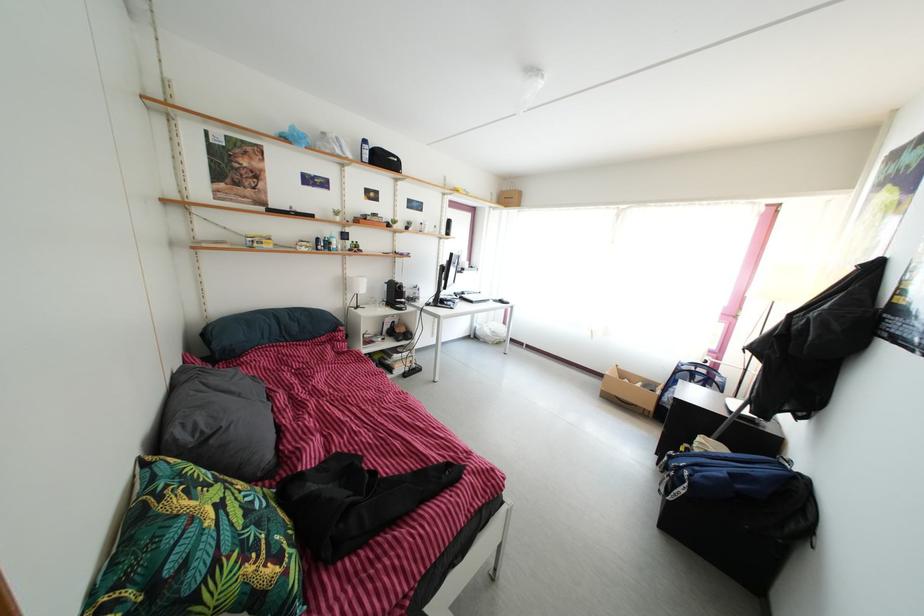
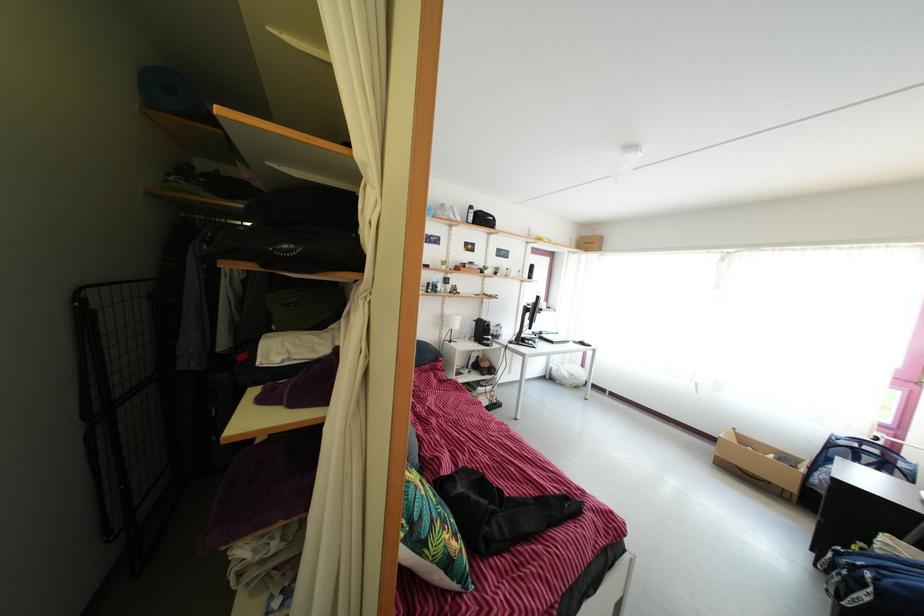
Where in the second image is the point corresponding to (x=687, y=499) from the first image?

(870, 605)